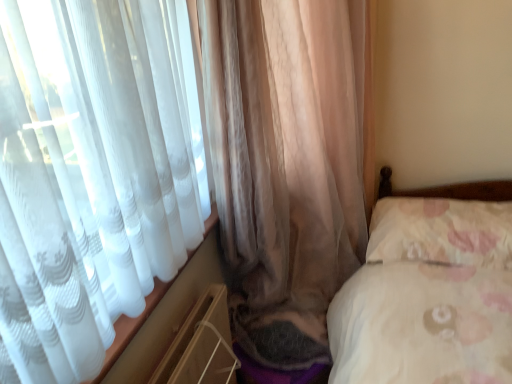
Question: Looking at the image, does translucent fabric curtain at left, marked as the 1th curtain in a right-to-left arrangement, seem bigger or smaller compared to fluffy white pillow at right?

Choices:
 (A) small
 (B) big

Answer: (A)

Question: Visually, is translucent fabric curtain at left, marked as the 1th curtain in a right-to-left arrangement, positioned to the left or to the right of fluffy white pillow at right?

Choices:
 (A) right
 (B) left

Answer: (B)

Question: Estimate the real-world distances between objects in this image. Which object is closer to the translucent beige curtain at left, the 1th curtain in the left-to-right sequence?

Choices:
 (A) fluffy white pillow at right
 (B) translucent fabric curtain at left, marked as the 1th curtain in a right-to-left arrangement

Answer: (B)

Question: Which object is positioned closest to the translucent beige curtain at left, the 1th curtain in the left-to-right sequence?

Choices:
 (A) translucent fabric curtain at left, marked as the 1th curtain in a right-to-left arrangement
 (B) fluffy white pillow at right

Answer: (A)